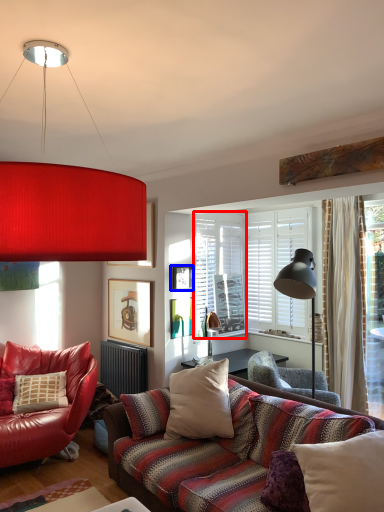
Question: Which of the following is the farthest to the observer, window screen (highlighted by a red box) or picture frame (highlighted by a blue box)?

Choices:
 (A) window screen
 (B) picture frame

Answer: (A)